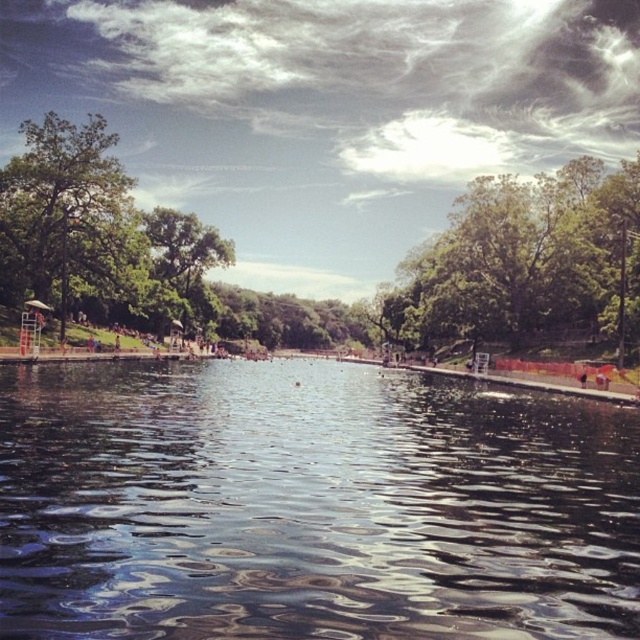
You are a photographer trying to capture a shot of the transparent water at center and the green leafy tree at upper center. Which object should you focus on first if you want to include both in your frame without moving the camera?

You should focus on the transparent water at center first because it is positioned on the left side of the green leafy tree at upper center, so capturing it first ensures both objects are in frame without needing to adjust the camera position.

You are standing at the center of the image and want to move towards the transparent water at center. What direction should you move in?

Since the transparent water at center is located at point 0.792 on the x axis and 0.484 on the y axis, you should move towards the right and slightly downward to reach it.

You are standing at the edge of the water and want to take a photo of the green leafy tree at upper center and the green leafy tree at left. Which tree will appear closer to you in the photo?

The green leafy tree at upper center will appear closer in the photo because it is positioned in front of the green leafy tree at left.